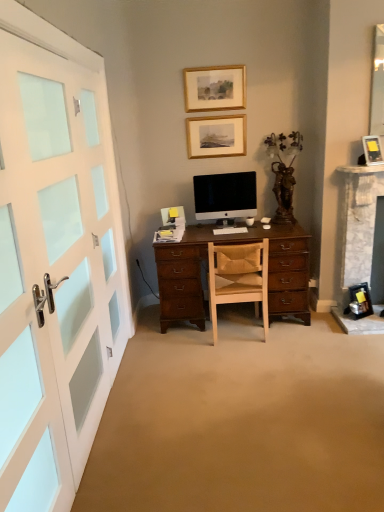
Question: Could you tell me if brown wooden statue at upper right is facing white glossy computer mouse at center?

Choices:
 (A) no
 (B) yes

Answer: (B)

Question: Is white glossy computer mouse at center surrounded by brown wooden statue at upper right?

Choices:
 (A) yes
 (B) no

Answer: (B)

Question: Considering the relative sizes of brown wooden statue at upper right and white glossy computer mouse at center in the image provided, is brown wooden statue at upper right thinner than white glossy computer mouse at center?

Choices:
 (A) no
 (B) yes

Answer: (A)

Question: Considering the relative sizes of brown wooden statue at upper right and white glossy computer mouse at center in the image provided, is brown wooden statue at upper right bigger than white glossy computer mouse at center?

Choices:
 (A) yes
 (B) no

Answer: (A)

Question: Is brown wooden statue at upper right in front of white glossy computer mouse at center?

Choices:
 (A) no
 (B) yes

Answer: (B)

Question: Is brown wooden statue at upper right completely or partially outside of white glossy computer mouse at center?

Choices:
 (A) yes
 (B) no

Answer: (A)

Question: Does brown wooden statue at upper right have a greater height compared to white matte computer keyboard at center?

Choices:
 (A) yes
 (B) no

Answer: (A)

Question: From the image's perspective, is brown wooden statue at upper right beneath white matte computer keyboard at center?

Choices:
 (A) yes
 (B) no

Answer: (B)

Question: Does brown wooden statue at upper right lie behind white matte computer keyboard at center?

Choices:
 (A) yes
 (B) no

Answer: (B)

Question: Considering the relative positions of brown wooden statue at upper right and white matte computer keyboard at center in the image provided, is brown wooden statue at upper right in front of white matte computer keyboard at center?

Choices:
 (A) no
 (B) yes

Answer: (B)

Question: Would you say brown wooden statue at upper right contains white matte computer keyboard at center?

Choices:
 (A) yes
 (B) no

Answer: (B)

Question: From the image's perspective, is brown wooden statue at upper right above white matte computer keyboard at center?

Choices:
 (A) no
 (B) yes

Answer: (B)

Question: Considering the relative positions of matte black picture frame at upper right, which is counted as the 3th picture frame, starting from the left, and white painted wood door at left in the image provided, is matte black picture frame at upper right, which is counted as the 3th picture frame, starting from the left, to the left of white painted wood door at left from the viewer's perspective?

Choices:
 (A) yes
 (B) no

Answer: (B)